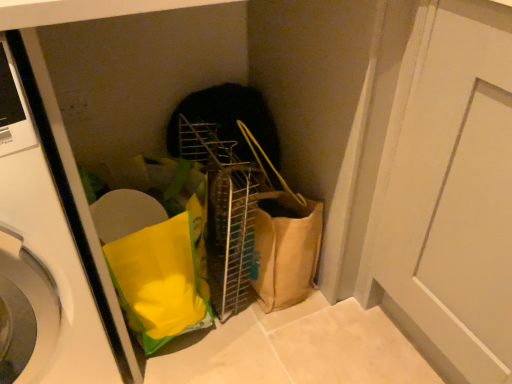
Question: Can you confirm if white matte door at center-right is bigger than white glossy washing machine at left?

Choices:
 (A) no
 (B) yes

Answer: (A)

Question: Is white matte door at center-right facing towards white glossy washing machine at left?

Choices:
 (A) yes
 (B) no

Answer: (A)

Question: From a real-world perspective, is white matte door at center-right positioned under white glossy washing machine at left based on gravity?

Choices:
 (A) yes
 (B) no

Answer: (A)

Question: Does white matte door at center-right lie behind white glossy washing machine at left?

Choices:
 (A) yes
 (B) no

Answer: (A)

Question: Is white matte door at center-right with white glossy washing machine at left?

Choices:
 (A) no
 (B) yes

Answer: (A)

Question: Considering the relative sizes of white matte door at center-right and white glossy washing machine at left in the image provided, is white matte door at center-right wider than white glossy washing machine at left?

Choices:
 (A) yes
 (B) no

Answer: (B)

Question: Does white glossy washing machine at left turn towards white matte door at center-right?

Choices:
 (A) no
 (B) yes

Answer: (A)

Question: From the image's perspective, does white glossy washing machine at left appear lower than white matte door at center-right?

Choices:
 (A) yes
 (B) no

Answer: (B)

Question: Considering the relative sizes of white glossy washing machine at left and white matte door at center-right in the image provided, is white glossy washing machine at left taller than white matte door at center-right?

Choices:
 (A) no
 (B) yes

Answer: (B)

Question: Does white glossy washing machine at left come in front of white matte door at center-right?

Choices:
 (A) yes
 (B) no

Answer: (A)

Question: Is white glossy washing machine at left surrounding white matte door at center-right?

Choices:
 (A) no
 (B) yes

Answer: (A)

Question: Is white glossy washing machine at left at the left side of white matte door at center-right?

Choices:
 (A) yes
 (B) no

Answer: (A)

Question: From the image's perspective, is white matte door at center-right located above or below white glossy washing machine at left?

Choices:
 (A) below
 (B) above

Answer: (A)